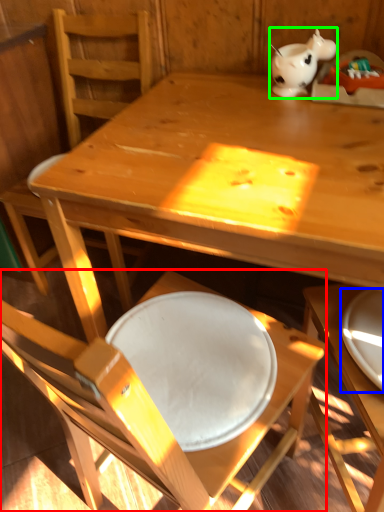
Question: Which is nearer to the chair (highlighted by a red box)? plate (highlighted by a blue box) or tableware (highlighted by a green box).

Choices:
 (A) plate
 (B) tableware

Answer: (A)